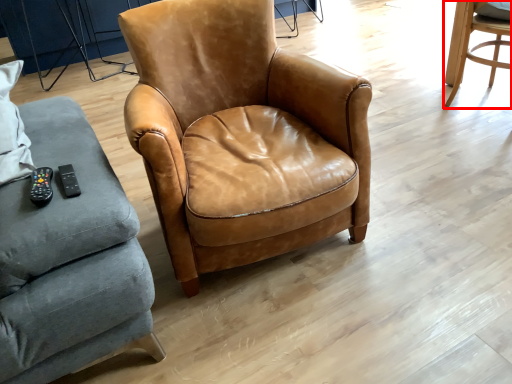
Question: Considering the relative positions of chair (annotated by the red box) and chair in the image provided, where is chair (annotated by the red box) located with respect to the staircase?

Choices:
 (A) left
 (B) right

Answer: (B)